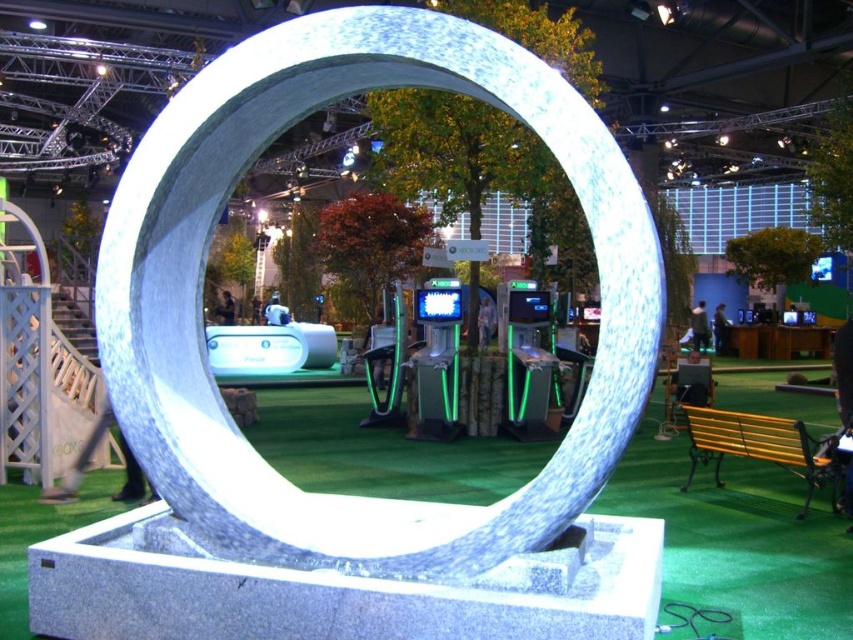
Is white marble ring at center to the left of green artificial turf at center from the viewer's perspective?

Indeed, white marble ring at center is positioned on the left side of green artificial turf at center.

Between white marble ring at center and green artificial turf at center, which one has more height?

white marble ring at center

This screenshot has height=640, width=853. I want to click on white marble ring at center, so click(202, 273).